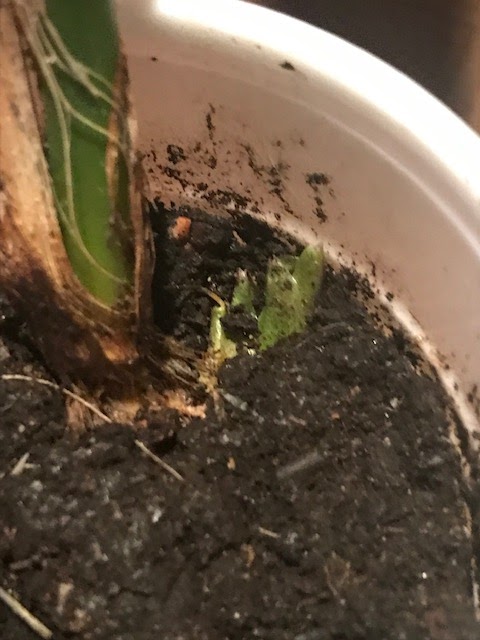
Locate an element on the screen. This screenshot has height=640, width=480. plant pot is located at coordinates (385, 166).